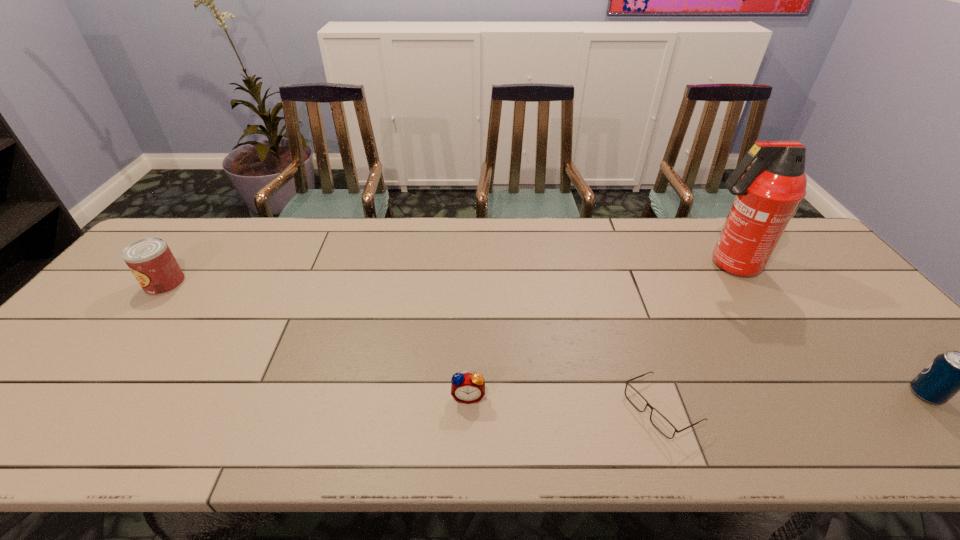
You are a GUI agent. You are given a task and a screenshot of the screen. Output one action in this format:
    pyautogui.click(x=<x>, y=<y>)
    Task: Click on the free location located 0.200m on the trigger side of the tallest object
    Image resolution: width=960 pixels, height=540 pixels.
    Given the screenshot: What is the action you would take?
    pyautogui.click(x=630, y=265)

You are a GUI agent. You are given a task and a screenshot of the screen. Output one action in this format:
    pyautogui.click(x=<x>, y=<y>)
    Task: Click on the free region located on the right of the can
    This screenshot has height=540, width=960.
    Given the screenshot: What is the action you would take?
    pyautogui.click(x=256, y=284)

Locate an element on the screen. This screenshot has height=540, width=960. vacant space located on the back of the soda can is located at coordinates (840, 298).

At what (x,y) coordinates should I click in order to perform the action: click on vacant space located 0.050m on the front-facing side of the fourth tallest object. Please return your answer as a coordinate pair (x, y). Looking at the image, I should click on (468, 425).

Where is `free location located 0.220m with the lenses facing outward on the shortest object`? free location located 0.220m with the lenses facing outward on the shortest object is located at coordinates (526, 409).

Where is `free space located 0.390m with the lenses facing outward on the shortest object`? The width and height of the screenshot is (960, 540). free space located 0.390m with the lenses facing outward on the shortest object is located at coordinates (448, 409).

What are the coordinates of `vacant position located with the lenses facing outward on the shortest object` in the screenshot? It's located at (462, 409).

You are a GUI agent. You are given a task and a screenshot of the screen. Output one action in this format:
    pyautogui.click(x=<x>, y=<y>)
    Task: Click on the object that is at the far edge
    
    Given the screenshot: What is the action you would take?
    pos(767,195)

Locate an element on the screen. The height and width of the screenshot is (540, 960). object present at the near edge is located at coordinates (662, 424).

This screenshot has height=540, width=960. In order to click on object positioned at the left edge in this screenshot , I will do `click(151, 261)`.